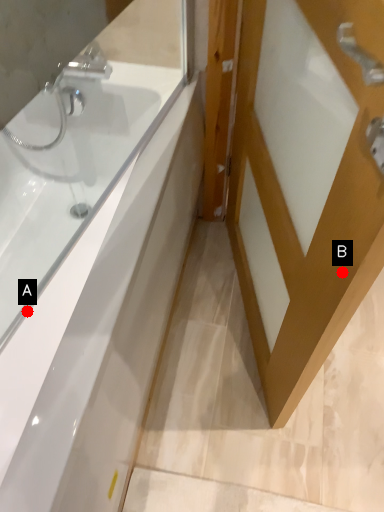
Question: Two points are circled on the image, labeled by A and B beside each circle. Among these points, which one is nearest to the camera?

Choices:
 (A) A is closer
 (B) B is closer

Answer: (B)